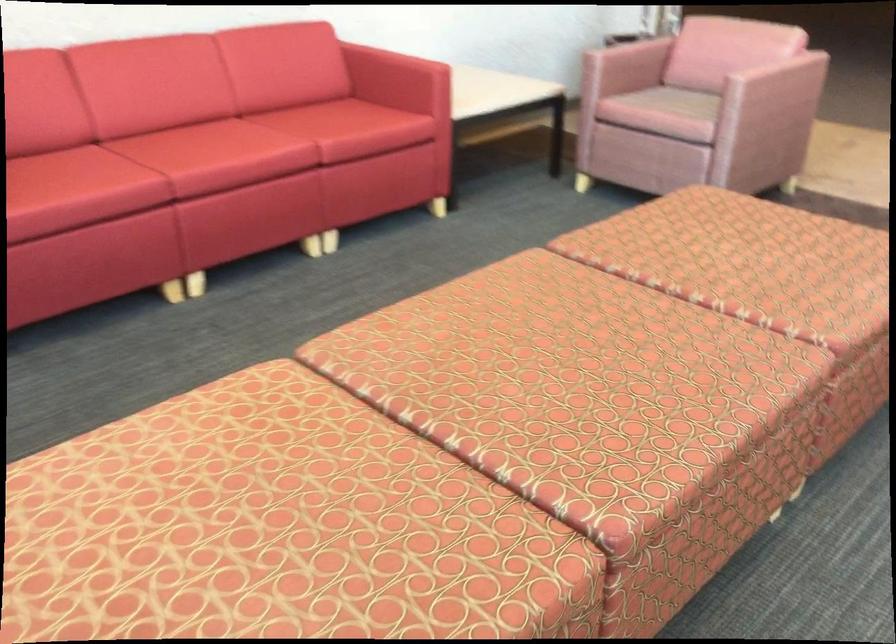
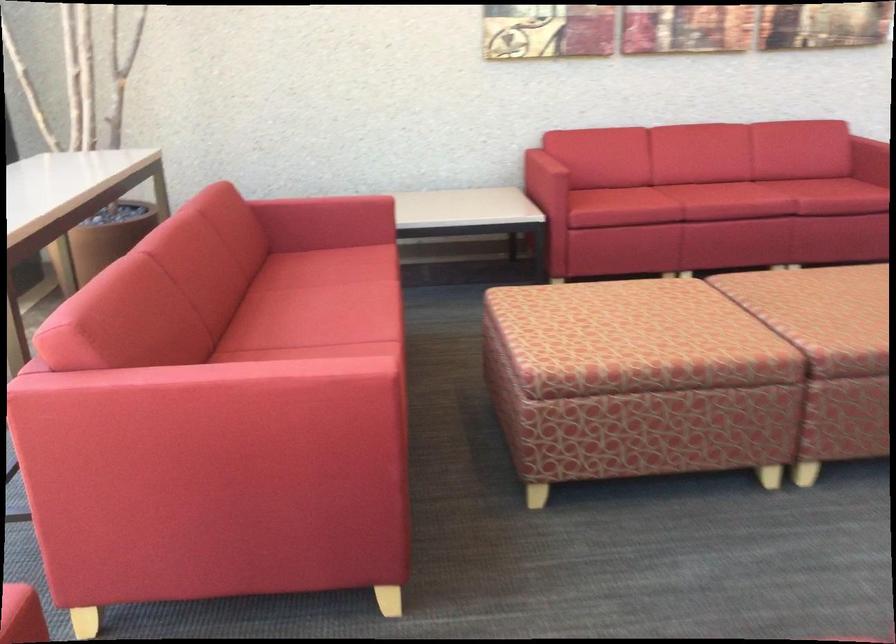
Find the pixel in the second image that matches (x=552, y=426) in the first image.

(834, 317)